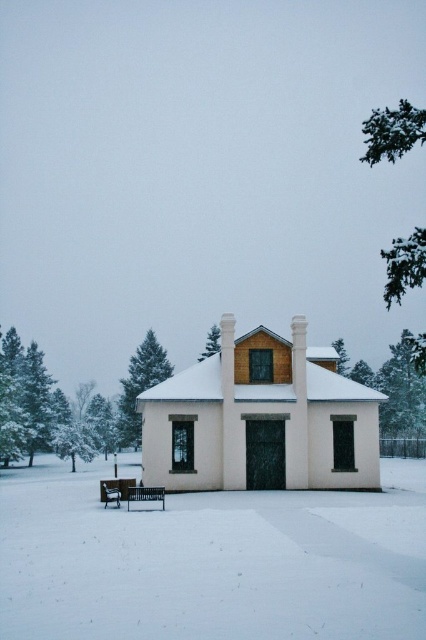
You are standing at a point and want to walk towards the building in the winter scene. The point you are standing at is labeled as point [163,515]. If you start walking directly towards the building, how far will you have to walk to reach it?

The distance between point [163,515] and the viewer is 20.98 meters, so you will have to walk 20.98 meters to reach the building.

You are standing at the entrance of the small building and want to walk towards the point labeled point (129, 502). Will you pass by point (216, 326) before reaching your destination?

Yes, you will pass by point (216, 326) before reaching point (129, 502) because point (129, 502) is in front of point (216, 326), meaning it is closer to your current position at the entrance.

You are standing in front of the building and want to walk to the wooden bench at lower left. Is the white powdery snow at center between you and the bench?

Yes, the white powdery snow at center is between you and the wooden bench at lower left because it is closer to the viewer than the bench.